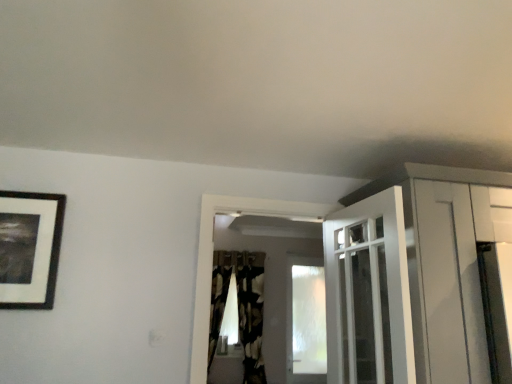
Question: Is black textured curtain at center taller than black matte picture frame at upper left?

Choices:
 (A) yes
 (B) no

Answer: (A)

Question: Is black matte picture frame at upper left at the back of black textured curtain at center?

Choices:
 (A) no
 (B) yes

Answer: (A)

Question: Is black matte picture frame at upper left located within black textured curtain at center?

Choices:
 (A) no
 (B) yes

Answer: (A)

Question: Can you confirm if black textured curtain at center is thinner than black matte picture frame at upper left?

Choices:
 (A) no
 (B) yes

Answer: (A)

Question: Is black textured curtain at center touching black matte picture frame at upper left?

Choices:
 (A) yes
 (B) no

Answer: (B)

Question: Considering the positions of black matte picture frame at upper left and white glossy door at upper center in the image, is black matte picture frame at upper left wider or thinner than white glossy door at upper center?

Choices:
 (A) wide
 (B) thin

Answer: (B)

Question: Is black matte picture frame at upper left inside or outside of white glossy door at upper center?

Choices:
 (A) inside
 (B) outside

Answer: (B)

Question: Visually, is black matte picture frame at upper left positioned to the left or to the right of white glossy door at upper center?

Choices:
 (A) right
 (B) left

Answer: (B)

Question: In the image, is black matte picture frame at upper left positioned in front of or behind white glossy door at upper center?

Choices:
 (A) behind
 (B) front

Answer: (A)

Question: Is white glossy door at upper center inside the boundaries of black matte picture frame at upper left, or outside?

Choices:
 (A) inside
 (B) outside

Answer: (B)

Question: Is white glossy door at upper center bigger or smaller than black matte picture frame at upper left?

Choices:
 (A) small
 (B) big

Answer: (B)

Question: From the image's perspective, is white glossy door at upper center positioned above or below black matte picture frame at upper left?

Choices:
 (A) below
 (B) above

Answer: (A)

Question: Relative to black matte picture frame at upper left, is white glossy door at upper center in front or behind?

Choices:
 (A) front
 (B) behind

Answer: (A)

Question: Visually, is black textured curtain at center positioned to the left or to the right of white glossy door at upper center?

Choices:
 (A) right
 (B) left

Answer: (B)

Question: Looking at their shapes, would you say black textured curtain at center is wider or thinner than white glossy door at upper center?

Choices:
 (A) thin
 (B) wide

Answer: (B)